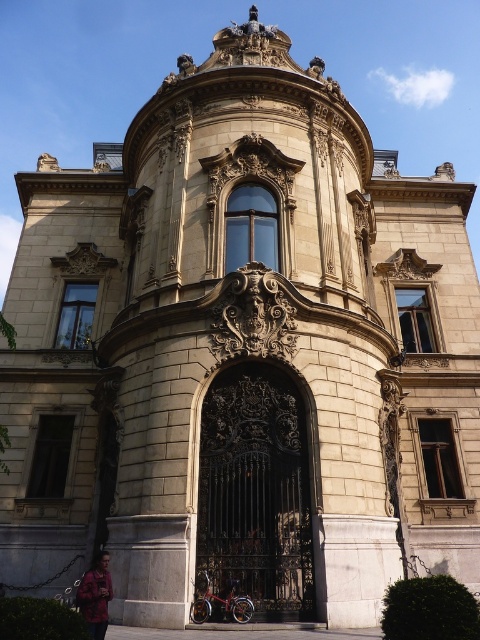
Question: In this image, where is black wrought iron gate at center located relative to red cotton jacket at lower left?

Choices:
 (A) above
 (B) below

Answer: (A)

Question: Is black wrought iron gate at center to the left of red cotton jacket at lower left from the viewer's perspective?

Choices:
 (A) no
 (B) yes

Answer: (A)

Question: Does black wrought iron gate at center appear on the left side of red cotton jacket at lower left?

Choices:
 (A) yes
 (B) no

Answer: (B)

Question: Which object appears closest to the camera in this image?

Choices:
 (A) black wrought iron gate at center
 (B) red cotton jacket at lower left

Answer: (B)

Question: Which point is farther from the camera taking this photo?

Choices:
 (A) (92, 595)
 (B) (265, 547)

Answer: (B)